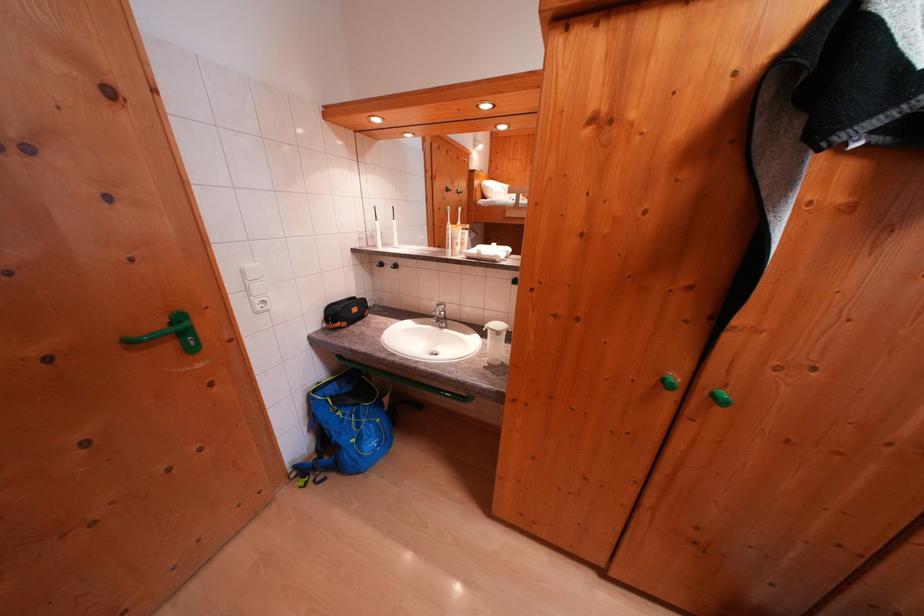
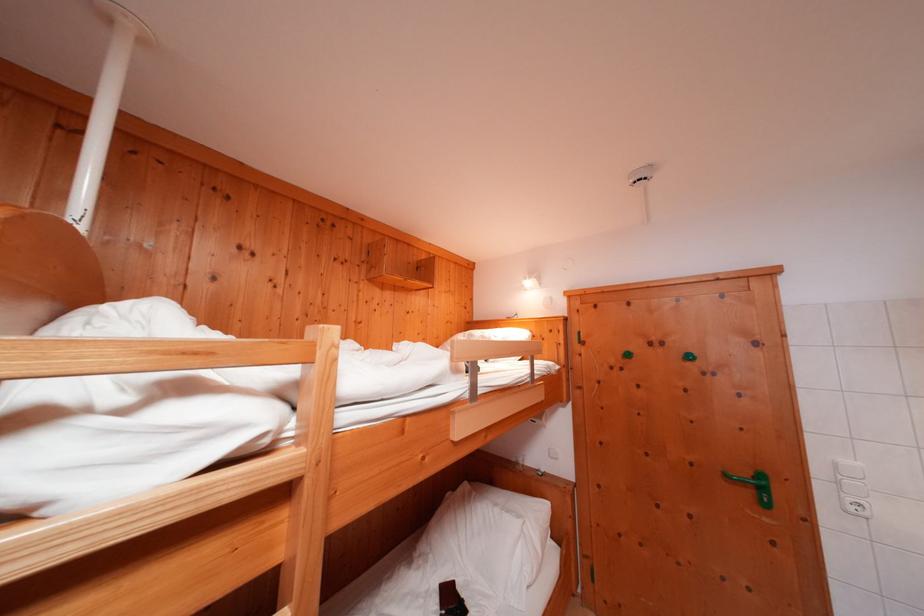
Locate, in the second image, the point that corresponds to point 195,336 in the first image.

(771, 493)